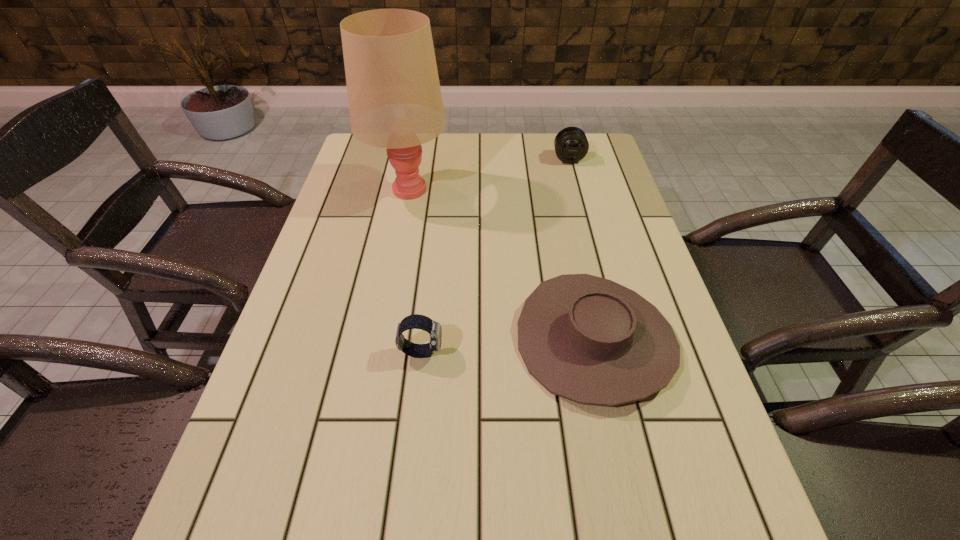
Select which object is the closest to the tallest object. Please provide its 2D coordinates. Your answer should be formatted as a tuple, i.e. [(x, y)], where the tuple contains the x and y coordinates of a point satisfying the conditions above.

[(588, 339)]

Identify which object is the closest to the telephoto lens. Please provide its 2D coordinates. Your answer should be formatted as a tuple, i.e. [(x, y)], where the tuple contains the x and y coordinates of a point satisfying the conditions above.

[(395, 102)]

You are a GUI agent. You are given a task and a screenshot of the screen. Output one action in this format:
    pyautogui.click(x=<x>, y=<y>)
    Task: Click on the vacant space that satisfies the following two spatial constraints: 1. on the front side of the lampshade; 2. on the left side of the cowboy hat
    
    Given the screenshot: What is the action you would take?
    pyautogui.click(x=378, y=340)

Identify the location of vacant space that satisfies the following two spatial constraints: 1. on the front side of the cowboy hat; 2. on the left side of the lampshade. The height and width of the screenshot is (540, 960). (378, 340).